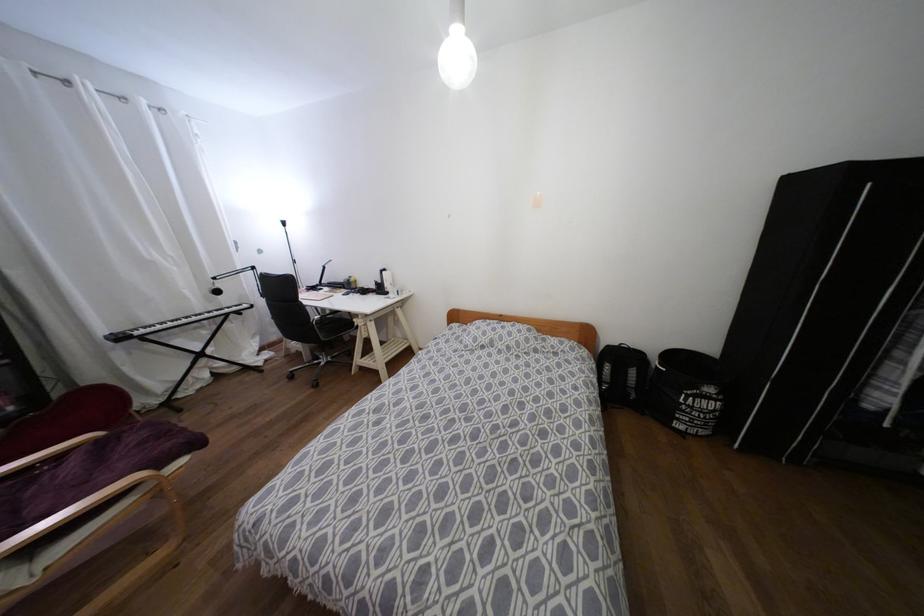
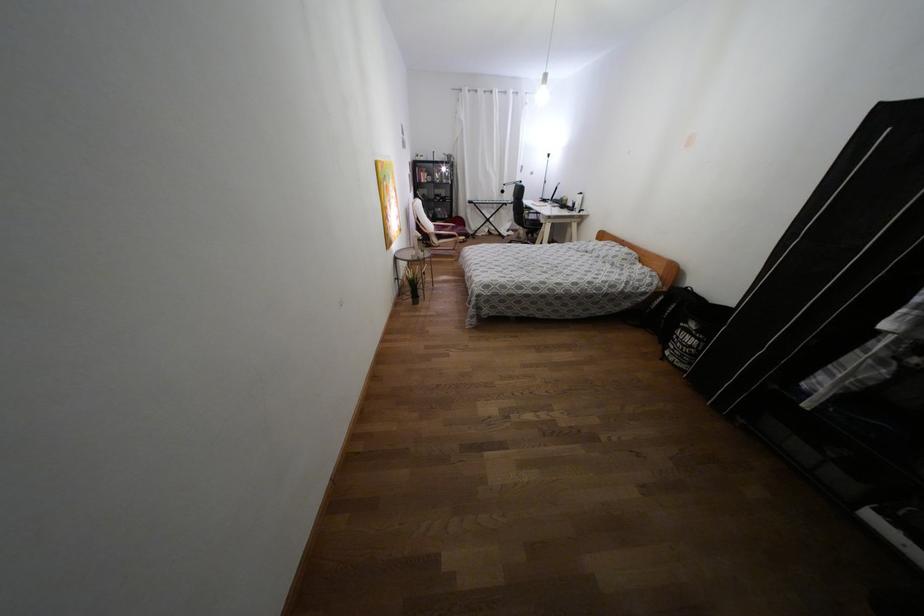
Locate, in the second image, the point that corresponds to [689,407] in the first image.

(676, 337)